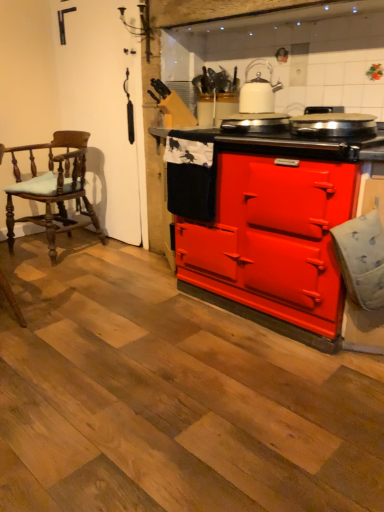
In order to face wooden polished chair at left, should I rotate leftwards or rightwards?

Rotate your view left by about 17.742°.

This screenshot has width=384, height=512. Describe the element at coordinates (271, 225) in the screenshot. I see `matte red stove at center` at that location.

Find the location of a particular element. This screenshot has height=512, width=384. shiny metallic pan at center, the 1th appliance from the right is located at coordinates (334, 125).

In order to face shiny metallic pan at center, the 1th appliance from the right, should I rotate leftwards or rightwards?

Rotate right and turn 17.850 degrees.

Where is `wooden polished chair at left`? The image size is (384, 512). wooden polished chair at left is located at coordinates (53, 188).

From the image's perspective, which object appears higher, matte red stove at center or red matte stove at center, marked as the second appliance in a right-to-left arrangement?

red matte stove at center, marked as the second appliance in a right-to-left arrangement, is shown above in the image.

Based on their positions, is matte red stove at center located to the left or right of red matte stove at center, placed as the 1th appliance when sorted from left to right?

From the image, it's evident that matte red stove at center is to the right of red matte stove at center, placed as the 1th appliance when sorted from left to right.

From a real-world perspective, is matte red stove at center physically located above or below red matte stove at center, placed as the 1th appliance when sorted from left to right?

matte red stove at center is situated lower than red matte stove at center, placed as the 1th appliance when sorted from left to right, in the real world.

Are matte red stove at center and red matte stove at center, marked as the second appliance in a right-to-left arrangement, far apart?

matte red stove at center is near red matte stove at center, marked as the second appliance in a right-to-left arrangement, not far away.

From the image's perspective, would you say shiny metallic pan at center, the second appliance in the left-to-right sequence, is positioned over wooden polished chair at left?

Yes, from the image's perspective, shiny metallic pan at center, the second appliance in the left-to-right sequence, is over wooden polished chair at left.

Considering the relative sizes of shiny metallic pan at center, the second appliance in the left-to-right sequence, and wooden polished chair at left in the image provided, is shiny metallic pan at center, the second appliance in the left-to-right sequence, bigger than wooden polished chair at left?

No, shiny metallic pan at center, the second appliance in the left-to-right sequence, is not bigger than wooden polished chair at left.

I want to click on chair behind the shiny metallic pan at center, the second appliance in the left-to-right sequence, so click(53, 188).

Is wooden polished chair at left completely or partially inside shiny metallic pan at center, the 1th appliance from the right?

No, wooden polished chair at left is not a part of shiny metallic pan at center, the 1th appliance from the right.

The height and width of the screenshot is (512, 384). What are the coordinates of `cabinetry below the shiny metallic pan at center, the 1th appliance from the right (from a real-world perspective)` in the screenshot? It's located at (271, 225).

How far apart are matte red stove at center and shiny metallic pan at center, the 1th appliance from the right?

matte red stove at center and shiny metallic pan at center, the 1th appliance from the right, are 44.95 centimeters apart.

Does point (301, 330) come in front of point (360, 124)?

No, (301, 330) is further to viewer.

Which object is closer to the camera taking this photo, matte red stove at center or shiny metallic pan at center, the second appliance in the left-to-right sequence?

matte red stove at center.

Considering the sizes of objects red matte stove at center, marked as the second appliance in a right-to-left arrangement, and white glossy kettle at upper center in the image provided, who is shorter, red matte stove at center, marked as the second appliance in a right-to-left arrangement, or white glossy kettle at upper center?

red matte stove at center, marked as the second appliance in a right-to-left arrangement.

Considering the relative sizes of red matte stove at center, placed as the 1th appliance when sorted from left to right, and white glossy kettle at upper center in the image provided, is red matte stove at center, placed as the 1th appliance when sorted from left to right, wider than white glossy kettle at upper center?

Correct, the width of red matte stove at center, placed as the 1th appliance when sorted from left to right, exceeds that of white glossy kettle at upper center.

Can you tell me how much red matte stove at center, placed as the 1th appliance when sorted from left to right, and white glossy kettle at upper center differ in facing direction?

1.61 degrees separate the facing orientations of red matte stove at center, placed as the 1th appliance when sorted from left to right, and white glossy kettle at upper center.

Considering the relative positions of red matte stove at center, marked as the second appliance in a right-to-left arrangement, and white glossy kettle at upper center in the image provided, is red matte stove at center, marked as the second appliance in a right-to-left arrangement, behind white glossy kettle at upper center?

No, red matte stove at center, marked as the second appliance in a right-to-left arrangement, is closer to the camera.

Considering the sizes of red matte stove at center, marked as the second appliance in a right-to-left arrangement, and matte red stove at center in the image, is red matte stove at center, marked as the second appliance in a right-to-left arrangement, wider or thinner than matte red stove at center?

red matte stove at center, marked as the second appliance in a right-to-left arrangement, is thinner than matte red stove at center.

From the image's perspective, which object appears higher, red matte stove at center, marked as the second appliance in a right-to-left arrangement, or matte red stove at center?

red matte stove at center, marked as the second appliance in a right-to-left arrangement, appears higher in the image.

Considering the sizes of red matte stove at center, placed as the 1th appliance when sorted from left to right, and matte red stove at center in the image, is red matte stove at center, placed as the 1th appliance when sorted from left to right, taller or shorter than matte red stove at center?

In the image, red matte stove at center, placed as the 1th appliance when sorted from left to right, appears to be shorter than matte red stove at center.

From a real-world perspective, is red matte stove at center, placed as the 1th appliance when sorted from left to right, physically below matte red stove at center?

Actually, red matte stove at center, placed as the 1th appliance when sorted from left to right, is physically above matte red stove at center in the real world.

Is matte red stove at center a part of shiny metallic pan at center, the 1th appliance from the right?

Actually, matte red stove at center is outside shiny metallic pan at center, the 1th appliance from the right.

From a real-world perspective, is shiny metallic pan at center, the 1th appliance from the right, physically below matte red stove at center?

No, from a real-world perspective, shiny metallic pan at center, the 1th appliance from the right, is not beneath matte red stove at center.

Looking at this image, who is shorter, shiny metallic pan at center, the second appliance in the left-to-right sequence, or matte red stove at center?

shiny metallic pan at center, the second appliance in the left-to-right sequence, is shorter.

Between point (330, 129) and point (228, 295), which one is positioned in front?

Point (330, 129)

Is wooden polished chair at left in contact with red matte stove at center, placed as the 1th appliance when sorted from left to right?

There is a gap between wooden polished chair at left and red matte stove at center, placed as the 1th appliance when sorted from left to right.

Which object is closer to the camera taking this photo, wooden polished chair at left or red matte stove at center, placed as the 1th appliance when sorted from left to right?

Positioned in front is red matte stove at center, placed as the 1th appliance when sorted from left to right.

Considering the sizes of wooden polished chair at left and red matte stove at center, placed as the 1th appliance when sorted from left to right, in the image, is wooden polished chair at left bigger or smaller than red matte stove at center, placed as the 1th appliance when sorted from left to right,?

In the image, wooden polished chair at left appears to be larger than red matte stove at center, placed as the 1th appliance when sorted from left to right.

Considering the relative sizes of wooden polished chair at left and red matte stove at center, placed as the 1th appliance when sorted from left to right, in the image provided, is wooden polished chair at left shorter than red matte stove at center, placed as the 1th appliance when sorted from left to right,?

Incorrect, the height of wooden polished chair at left does not fall short of that of red matte stove at center, placed as the 1th appliance when sorted from left to right.

The image size is (384, 512). I want to click on appliance that is on the left side of matte red stove at center, so click(256, 123).

Identify the location of the 2nd appliance positioned above the wooden polished chair at left (from a real-world perspective). Image resolution: width=384 pixels, height=512 pixels. (334, 125).

When comparing their distances from white glossy kettle at upper center, does matte red stove at center or wooden polished chair at left seem closer?

matte red stove at center is positioned closer to the anchor white glossy kettle at upper center.

When comparing their distances from wooden polished chair at left, does shiny metallic pan at center, the 1th appliance from the right, or matte red stove at center seem closer?

matte red stove at center is positioned closer to the anchor wooden polished chair at left.

When comparing their distances from matte red stove at center, does shiny metallic pan at center, the second appliance in the left-to-right sequence, or white glossy kettle at upper center seem closer?

shiny metallic pan at center, the second appliance in the left-to-right sequence, is positioned closer to the anchor matte red stove at center.

Which object lies further to the anchor point red matte stove at center, marked as the second appliance in a right-to-left arrangement, white glossy kettle at upper center or shiny metallic pan at center, the 1th appliance from the right?

shiny metallic pan at center, the 1th appliance from the right, is positioned further to the anchor red matte stove at center, marked as the second appliance in a right-to-left arrangement.

When comparing their distances from red matte stove at center, marked as the second appliance in a right-to-left arrangement, does shiny metallic pan at center, the second appliance in the left-to-right sequence, or matte red stove at center seem closer?

Based on the image, shiny metallic pan at center, the second appliance in the left-to-right sequence, appears to be nearer to red matte stove at center, marked as the second appliance in a right-to-left arrangement.

Based on their spatial positions, is red matte stove at center, placed as the 1th appliance when sorted from left to right, or shiny metallic pan at center, the second appliance in the left-to-right sequence, closer to matte red stove at center?

Among the two, red matte stove at center, placed as the 1th appliance when sorted from left to right, is located nearer to matte red stove at center.

When comparing their distances from shiny metallic pan at center, the 1th appliance from the right, does red matte stove at center, marked as the second appliance in a right-to-left arrangement, or wooden polished chair at left seem further?

wooden polished chair at left lies further to shiny metallic pan at center, the 1th appliance from the right, than the other object.

Based on their spatial positions, is wooden polished chair at left or matte red stove at center closer to shiny metallic pan at center, the 1th appliance from the right?

Among the two, matte red stove at center is located nearer to shiny metallic pan at center, the 1th appliance from the right.

Identify the location of cabinetry located between wooden polished chair at left and shiny metallic pan at center, the 1th appliance from the right, in the left-right direction. (271, 225).

Locate an element on the screen. The width and height of the screenshot is (384, 512). appliance positioned between shiny metallic pan at center, the second appliance in the left-to-right sequence, and white glossy kettle at upper center from near to far is located at coordinates click(x=256, y=123).

Where is `appliance between red matte stove at center, placed as the 1th appliance when sorted from left to right, and matte red stove at center vertically`? Image resolution: width=384 pixels, height=512 pixels. appliance between red matte stove at center, placed as the 1th appliance when sorted from left to right, and matte red stove at center vertically is located at coordinates (334, 125).

The width and height of the screenshot is (384, 512). Identify the location of appliance between wooden polished chair at left and matte red stove at center from left to right. (256, 123).